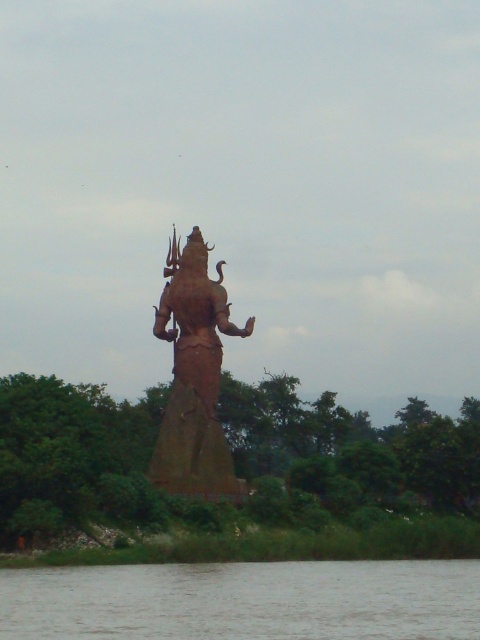
Who is more forward, (41,435) or (424,634)?

Positioned in front is point (424,634).

Is green leafy tree at center to the left of brown water at lower center from the viewer's perspective?

Yes, green leafy tree at center is to the left of brown water at lower center.

What do you see at coordinates (347, 454) in the screenshot? I see `green leafy tree at center` at bounding box center [347, 454].

Locate an element on the screen. The height and width of the screenshot is (640, 480). green leafy tree at center is located at coordinates (347, 454).

Who is positioned more to the left, green leafy tree at center or rusty metal statue at center?

From the viewer's perspective, rusty metal statue at center appears more on the left side.

Between point (265, 497) and point (216, 360), which one is positioned behind?

Positioned behind is point (216, 360).

Locate an element on the screen. The height and width of the screenshot is (640, 480). green leafy tree at center is located at coordinates (347, 454).

Does brown water at lower center have a smaller size compared to rusty metal statue at center?

Incorrect, brown water at lower center is not smaller in size than rusty metal statue at center.

Image resolution: width=480 pixels, height=640 pixels. What do you see at coordinates (244, 600) in the screenshot?
I see `brown water at lower center` at bounding box center [244, 600].

At what (x,y) coordinates should I click in order to perform the action: click on brown water at lower center. Please return your answer as a coordinate pair (x, y). Looking at the image, I should click on point(244,600).